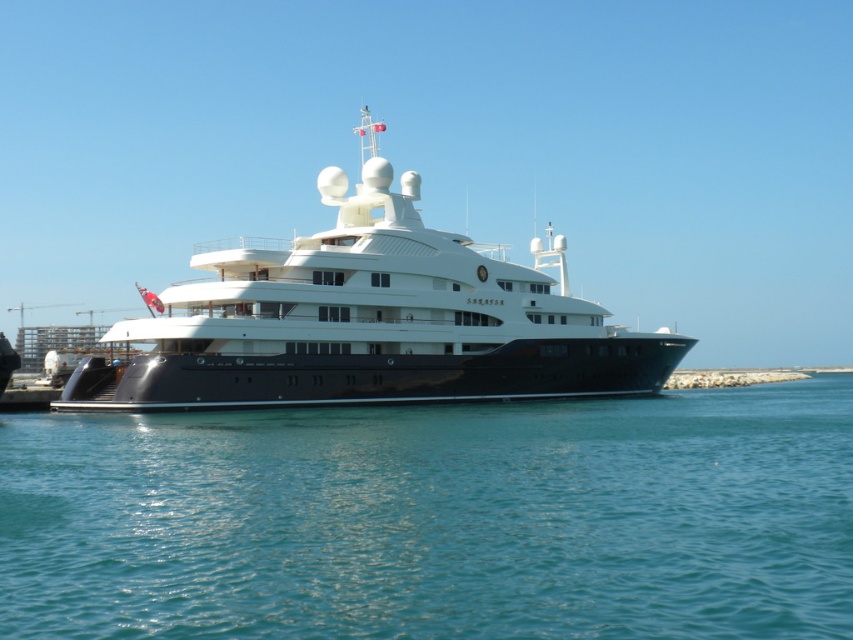
You are a photographer planning to capture the shiny white cruise ship at center and the blue water at lower center in a single frame. Given the spatial relationship between them, can you fit both elements into your camera viewfinder without moving your position?

The blue water at lower center has a smaller size compared to the shiny white cruise ship at center. Since the blue water is smaller, it should be possible to include both the shiny white cruise ship at center and the blue water at lower center within the camera viewfinder without moving your position.

You are standing on the dock and looking at the blue water at lower center and the shiny white cruise ship at center. Which object is positioned lower in the image?

The blue water at lower center is located below the shiny white cruise ship at center, so it is positioned lower in the image.

You are a tour guide on a boat that is 10 meters long. You want to navigate your boat between the blue water at lower center and the shiny white cruise ship at center. Can your boat fit through the space between them?

The blue water at lower center is 21.24 meters away from the shiny white cruise ship at center. Since your boat is 10 meters long, it can easily fit through the space between them as the distance is more than double the boat length.